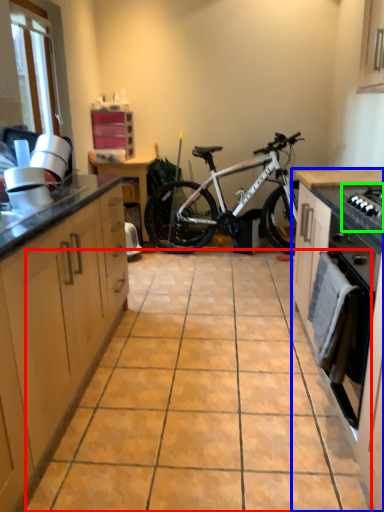
Question: Considering the real-world distances, which object is farthest from ceramic tile (highlighted by a red box)? cabinetry (highlighted by a blue box) or gas stove (highlighted by a green box)?

Choices:
 (A) cabinetry
 (B) gas stove

Answer: (B)